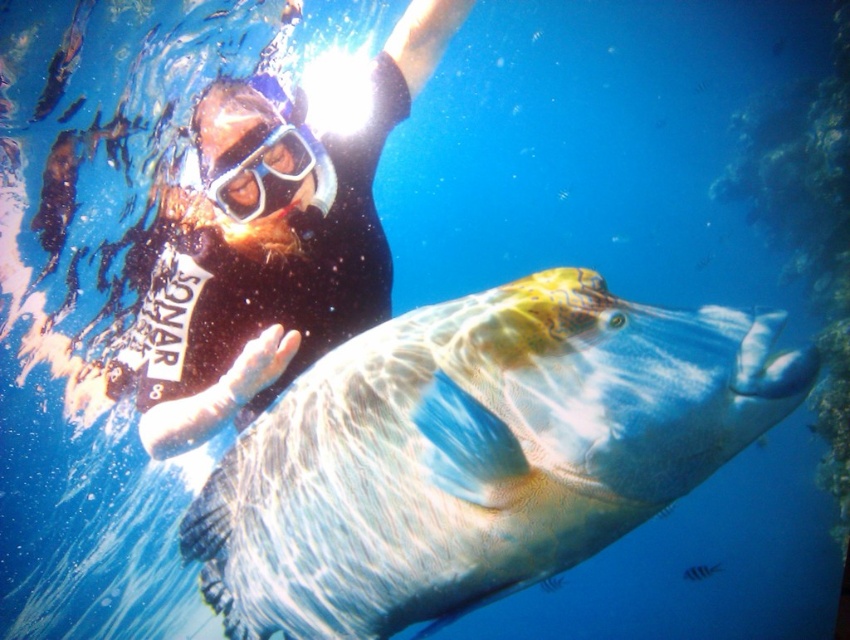
Who is more forward, (268, 433) or (320, 332)?

Point (268, 433)

Is the position of translucent blue fish at center less distant than that of matte black snorkel gear at upper center?

Yes, it is.

Locate an element on the screen. This screenshot has height=640, width=850. translucent blue fish at center is located at coordinates (476, 452).

Image resolution: width=850 pixels, height=640 pixels. Identify the location of translucent blue fish at center. (476, 452).

Who is taller, translucent blue fish at center or transparent plastic goggles at center?

Standing taller between the two is translucent blue fish at center.

Can you confirm if translucent blue fish at center is taller than transparent plastic goggles at center?

Yes.

Describe the element at coordinates (476, 452) in the screenshot. I see `translucent blue fish at center` at that location.

This screenshot has width=850, height=640. I want to click on translucent blue fish at center, so click(476, 452).

Between matte black snorkel gear at upper center and transparent plastic goggles at center, which one appears on the right side from the viewer's perspective?

From the viewer's perspective, transparent plastic goggles at center appears more on the right side.

How far apart are matte black snorkel gear at upper center and transparent plastic goggles at center?

9.04 inches

Is point (204, 241) farther from viewer compared to point (298, 164)?

Yes, point (204, 241) is farther from viewer.

Identify the location of matte black snorkel gear at upper center. Image resolution: width=850 pixels, height=640 pixels. (272, 243).